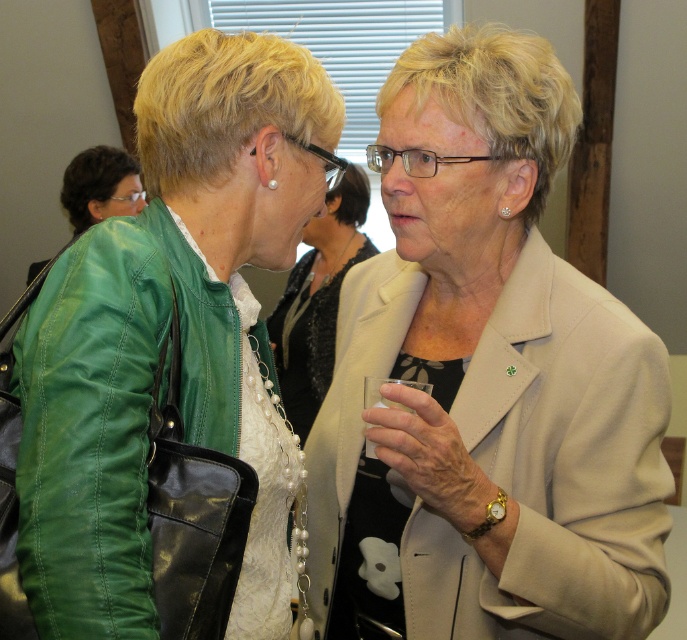
You are at the center of the image and want to move towards the green leather jacket at left. In which direction should you move?

You should move to the left to reach the green leather jacket at left since it is located at point 0.522 on the horizontal axis, which is to the left of the center point at 0.5.